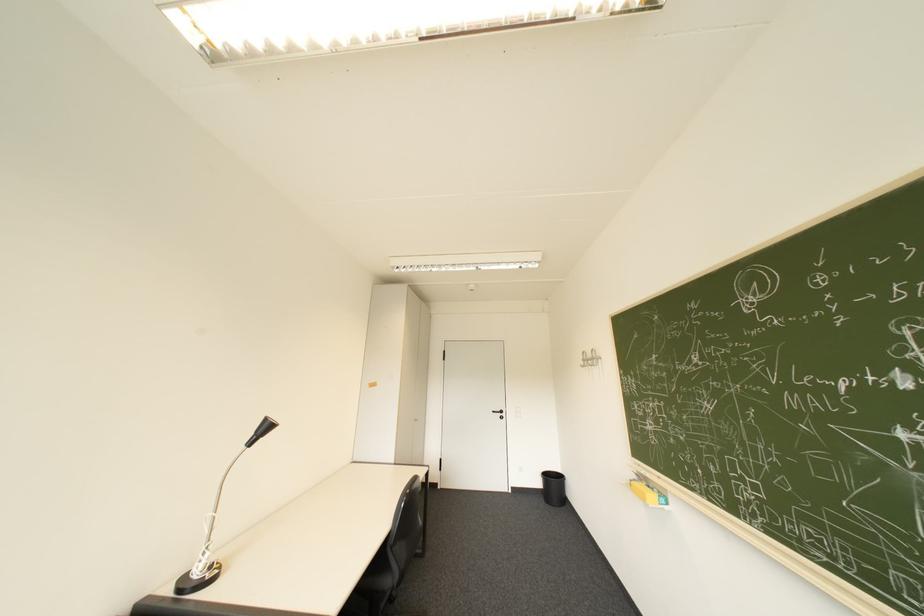
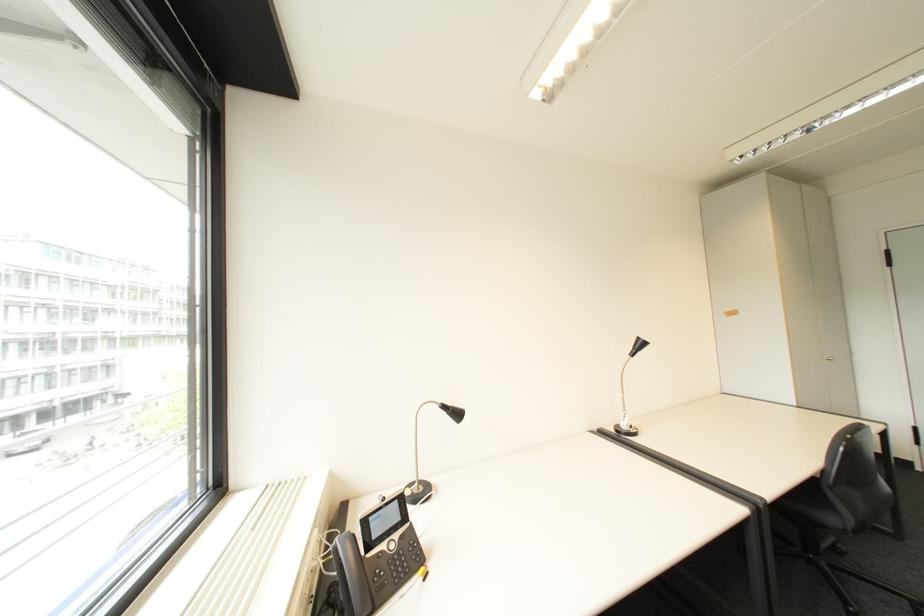
Where in the second image is the point corresponding to the point at 261,436 from the first image?

(640, 350)